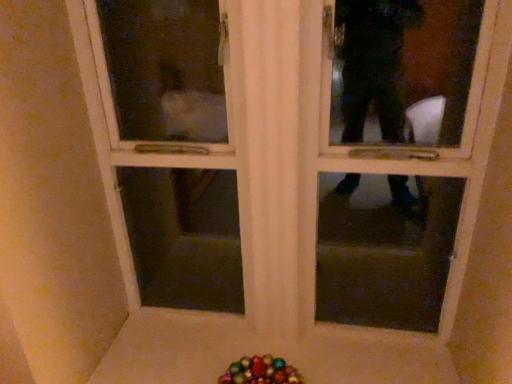
Locate an element on the screen. vacant area to the right of multicolored glass beads at lower center is located at coordinates (321, 364).